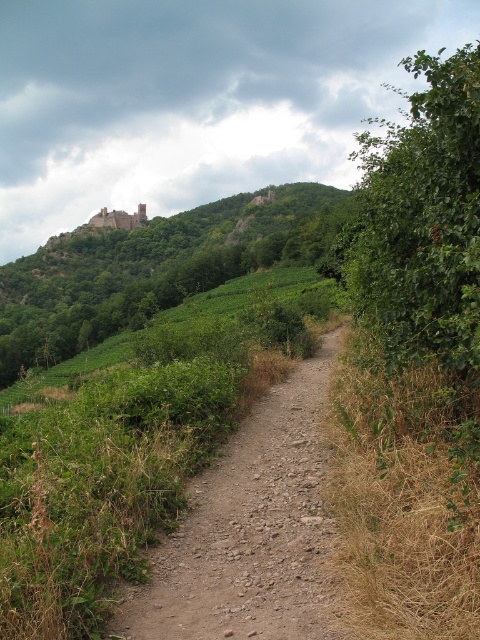
Question: Can you confirm if dusty gravel path at center is smaller than green leafy hillside at upper left?

Choices:
 (A) no
 (B) yes

Answer: (B)

Question: Which object is the closest to the green leafy hillside at upper left?

Choices:
 (A) dusty gravel path at center
 (B) red brick castle at upper center

Answer: (B)

Question: Observing the image, what is the correct spatial positioning of dusty gravel path at center in reference to green leafy hillside at upper left?

Choices:
 (A) right
 (B) left

Answer: (A)

Question: Which object is positioned farthest from the red brick castle at upper center?

Choices:
 (A) green leafy hillside at upper left
 (B) dusty gravel path at center

Answer: (B)

Question: Is green leafy hillside at upper left above red brick castle at upper center?

Choices:
 (A) yes
 (B) no

Answer: (B)

Question: Which point is farther to the camera?

Choices:
 (A) dusty gravel path at center
 (B) green leafy hillside at upper left
 (C) red brick castle at upper center

Answer: (C)